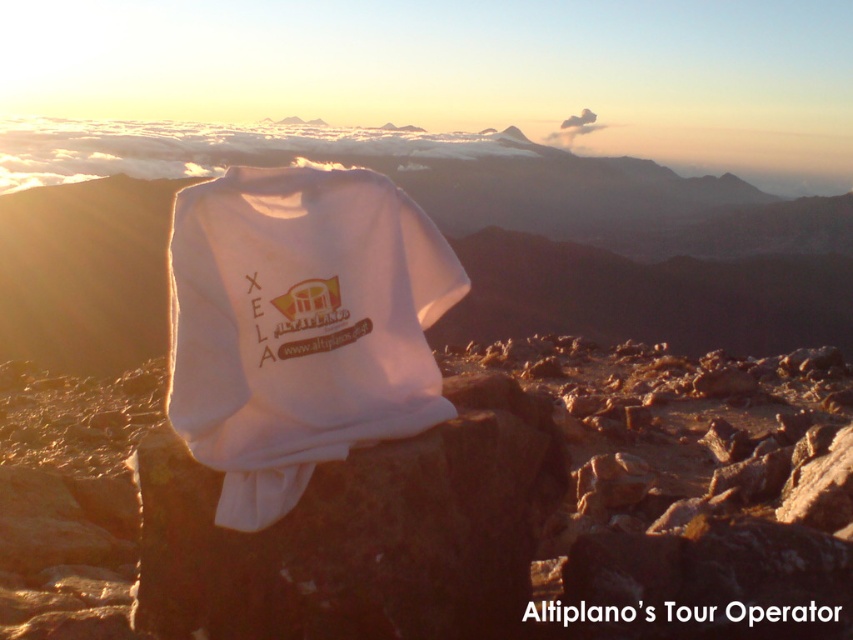
Does white fabric t-shirt at center have a larger size compared to white cotton t-shirt at center?

Yes, white fabric t-shirt at center is bigger than white cotton t-shirt at center.

Does white fabric t-shirt at center have a lesser width compared to white cotton t-shirt at center?

No.

The width and height of the screenshot is (853, 640). Describe the element at coordinates (439, 227) in the screenshot. I see `white fabric t-shirt at center` at that location.

The image size is (853, 640). What are the coordinates of `white fabric t-shirt at center` in the screenshot? It's located at (439, 227).

Does white fabric t-shirt at center come behind white fabric at center?

Yes, it is.

Who is positioned more to the left, white fabric t-shirt at center or white fabric at center?

From the viewer's perspective, white fabric t-shirt at center appears more on the left side.

Does point (207, 140) come closer to viewer compared to point (177, 570)?

No, it is not.

This screenshot has width=853, height=640. Identify the location of white fabric t-shirt at center. (439, 227).

Does white cotton t-shirt at center have a smaller size compared to white fabric at center?

Yes.

Locate an element on the screen. white cotton t-shirt at center is located at coordinates (300, 326).

Where is `white cotton t-shirt at center`? Image resolution: width=853 pixels, height=640 pixels. white cotton t-shirt at center is located at coordinates (300, 326).